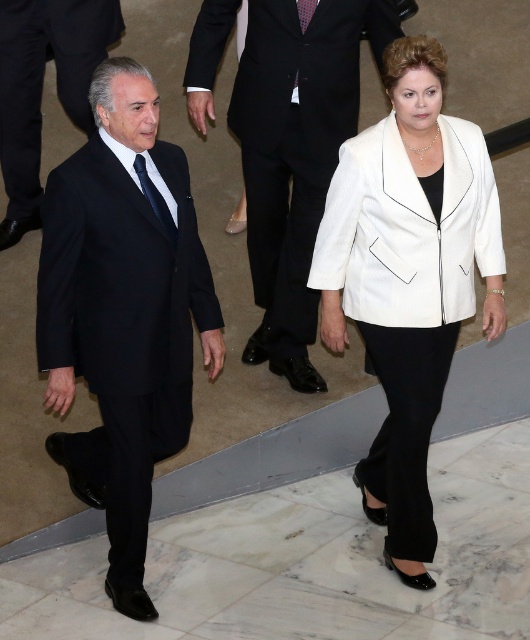
Question: Which of these objects is positioned closest to the white leather jacket at center?

Choices:
 (A) black satin suit at left
 (B) dark blue silk tie at left

Answer: (B)

Question: Which of the following is the closest to the observer?

Choices:
 (A) (310, 17)
 (B) (139, 108)

Answer: (B)

Question: In this image, where is red textured tie at center located relative to red dotted tie at center?

Choices:
 (A) below
 (B) above

Answer: (A)

Question: Which of the following is the closest to the observer?

Choices:
 (A) (281, 132)
 (B) (20, 157)

Answer: (A)

Question: Does matte black suit at center have a lesser width compared to dark blue silk tie at left?

Choices:
 (A) no
 (B) yes

Answer: (A)

Question: Does matte black suit at center appear over red dotted tie at center?

Choices:
 (A) no
 (B) yes

Answer: (A)